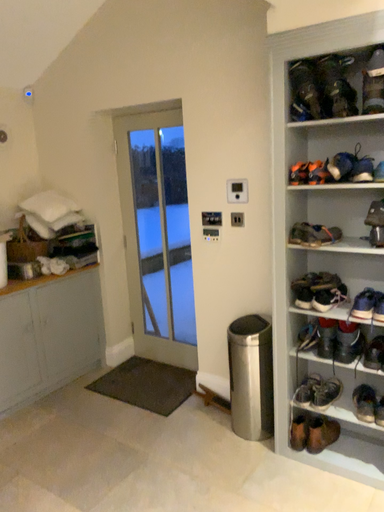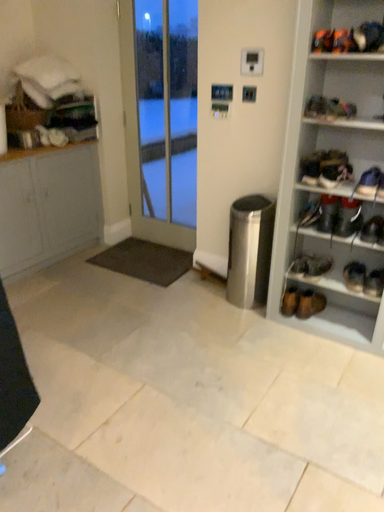
Question: How did the camera likely rotate when shooting the video?

Choices:
 (A) rotated upward
 (B) rotated downward

Answer: (B)